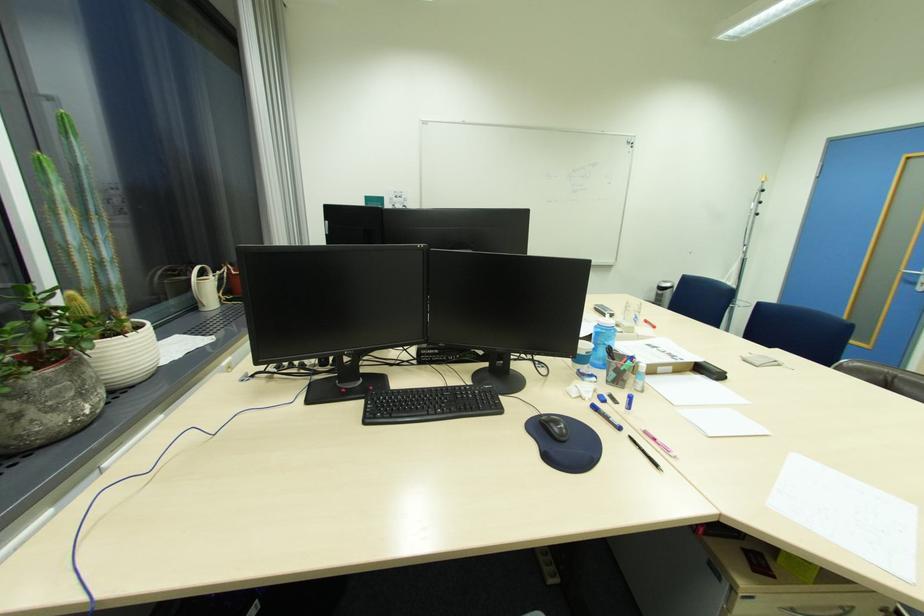
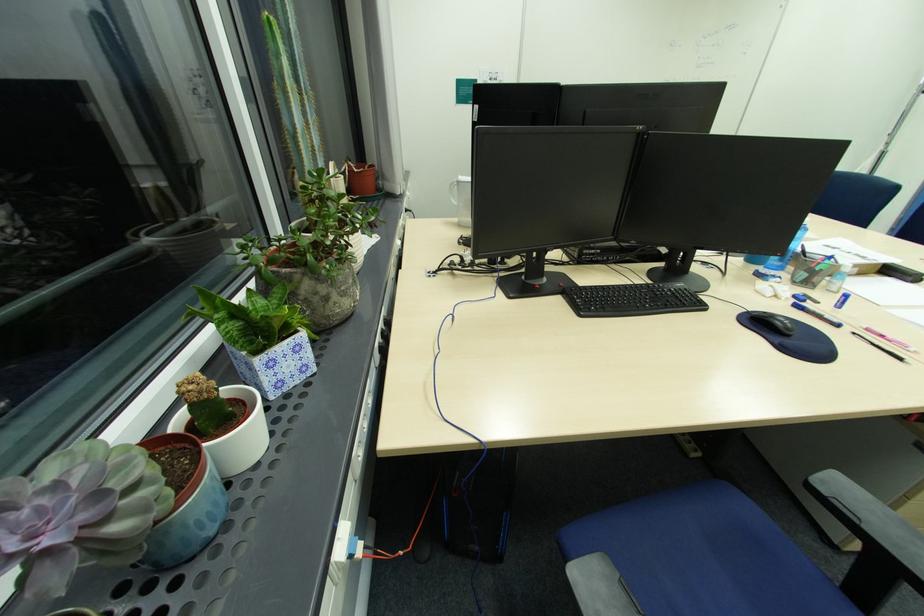
Question: Based on the continuous images, in which direction is the camera rotating? Reply with the corresponding letter.

Choices:
 (A) Left
 (B) Right
 (C) Up
 (D) Down

Answer: (D)